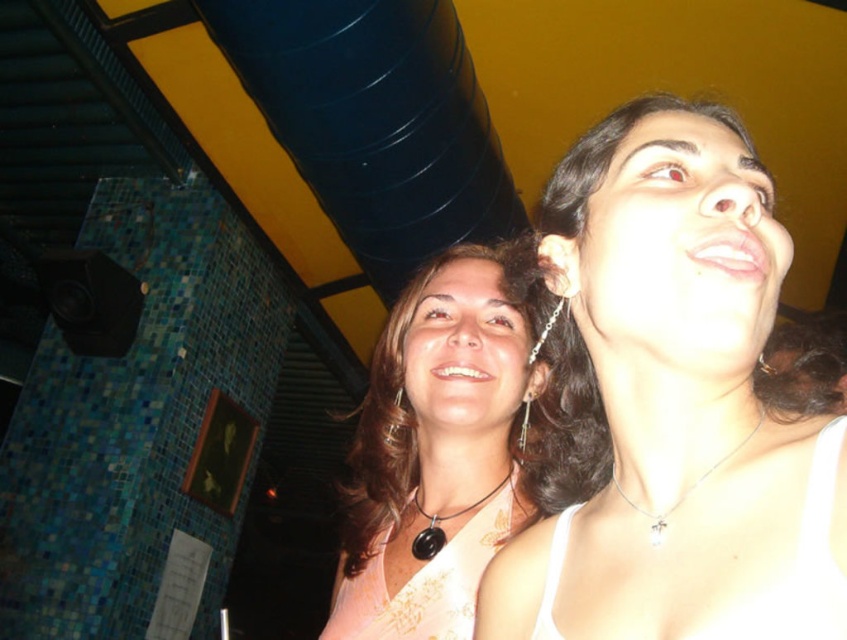
Question: Is white matte tank top at upper right bigger than black leather necklace at center?

Choices:
 (A) no
 (B) yes

Answer: (B)

Question: Does pink fabric at center have a greater width compared to black leather necklace at center?

Choices:
 (A) yes
 (B) no

Answer: (A)

Question: Considering the real-world distances, which object is farthest from the black leather necklace at center?

Choices:
 (A) pink fabric at center
 (B) silver metallic necklace at upper center
 (C) white matte tank top at upper right

Answer: (B)

Question: Which object appears farthest from the camera in this image?

Choices:
 (A) white matte tank top at upper right
 (B) pink fabric at center

Answer: (B)

Question: Observing the image, what is the correct spatial positioning of white matte tank top at upper right in reference to silver metallic necklace at upper center?

Choices:
 (A) above
 (B) below

Answer: (A)

Question: Which of the following is the closest to the observer?

Choices:
 (A) (552, 352)
 (B) (507, 394)
 (C) (502, 480)
 (D) (652, 536)

Answer: (D)